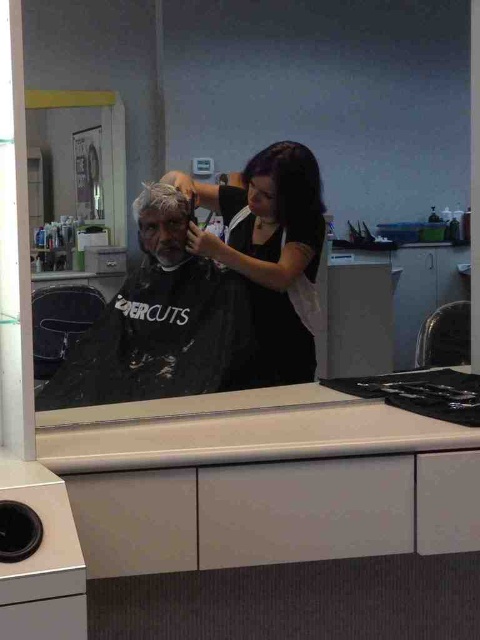
Question: Which of the following is the closest to the observer?

Choices:
 (A) (147, 211)
 (B) (186, 234)

Answer: (B)

Question: Estimate the real-world distances between objects in this image. Which object is closer to the black matte cape at center?

Choices:
 (A) dark purple hair at center
 (B) white matte hair at upper center

Answer: (A)

Question: Which point appears farthest from the camera in this image?

Choices:
 (A) (188, 200)
 (B) (238, 346)

Answer: (A)

Question: Is dark purple hair at center positioned behind white matte hair at upper center?

Choices:
 (A) yes
 (B) no

Answer: (B)

Question: From the image, what is the correct spatial relationship of black matte cape at center in relation to white matte hair at upper center?

Choices:
 (A) right
 (B) left

Answer: (A)

Question: Does black matte cape at center appear on the right side of dark purple hair at center?

Choices:
 (A) yes
 (B) no

Answer: (B)